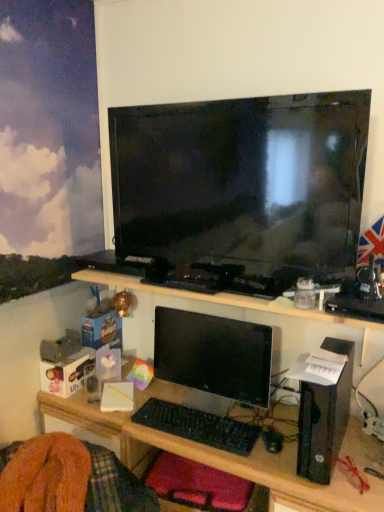
At what (x,y) coordinates should I click in order to perform the action: click on vacant region to the right of black plastic computer at right. Please return your answer as a coordinate pair (x, y). Looking at the image, I should click on (360, 443).